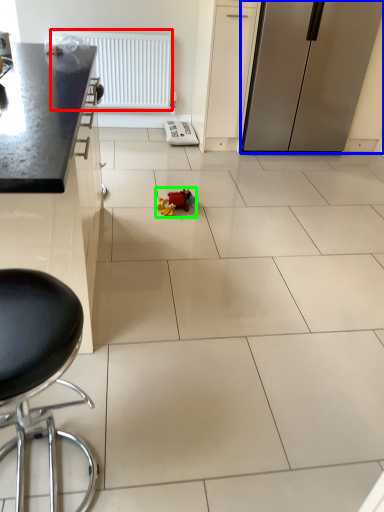
Question: Which is nearer to the radiator (highlighted by a red box)? refrigerator (highlighted by a blue box) or toy (highlighted by a green box).

Choices:
 (A) refrigerator
 (B) toy

Answer: (A)